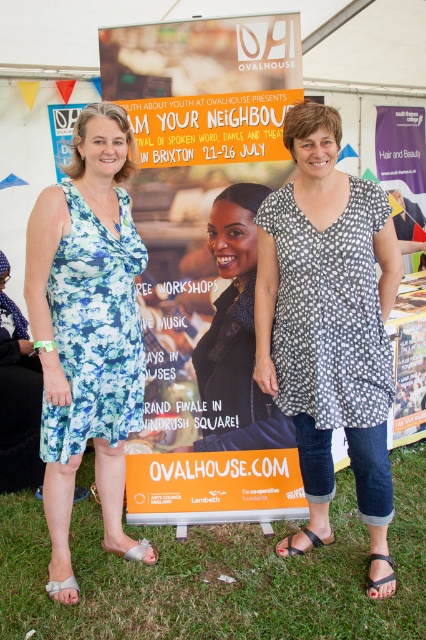
Consider the image. You are a photographer taking a picture of the black dotted dress at center and the black fabric sandal at lower center. Which object will appear closer to the camera in the photo?

The black dotted dress at center will appear closer to the camera because it is positioned in front of the black fabric sandal at lower center.

You are standing at the point labeled as point (66, 595) and want to take a photo of the two women in front of the Ovalhouse banner. If your camera has a focal length of 50mm and you are 2.20 meters away from the camera, what is the approximate angle of view needed to capture both women comfortably in the frame?

The point (66, 595) is 2.20 meters away from the camera. To capture both women comfortably, you would need an angle of view that accommodates their combined width at that distance. Using the camera specifications, the angle can be calculated to ensure they fit within the frame.

Based on the photo, you are a photographer trying to capture the black dotted dress at center in the image. According to the coordinates provided, where exactly is the black dotted dress located?

The black dotted dress at center is located at point coordinates of 0.486 on the x axis and 0.775 on the y axis.